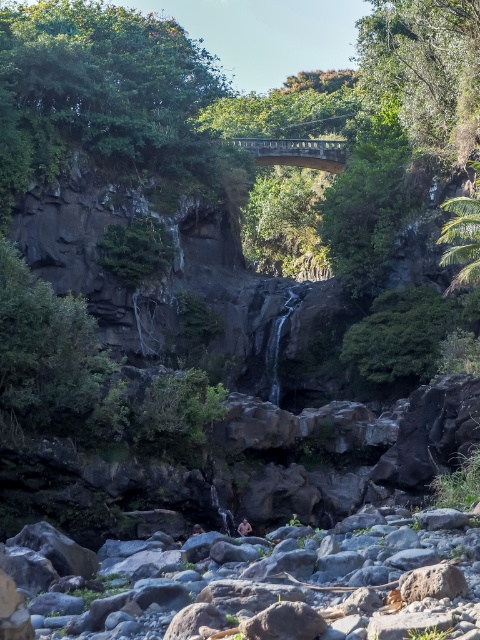
You are standing at the center of the riverbed and looking towards the waterfall. Where is the green leafy tree at upper left located relative to your position?

The green leafy tree at upper left is located at the upper left direction from your position, at coordinates approximately 0.152 on the x axis and 0.223 on the y axis.

You are a hiker who wants to take a photo of the two green leafy trees in the background. Which tree, the green leafy tree at upper left or the green leafy tree at upper center, would appear larger in your photo?

The green leafy tree at upper left would appear larger in your photo because it is much taller than the green leafy tree at upper center.

You are standing at the edge of the rocky riverbed and want to take a photo of the green leafy tree at upper left. If your camera has a maximum zoom range of 50 meters, can you clearly capture the tree in your photo?

The green leafy tree at upper left is 63.30 meters away from the viewer. Since the camera can only zoom up to 50 meters, you won not be able to clearly capture the tree in your photo.